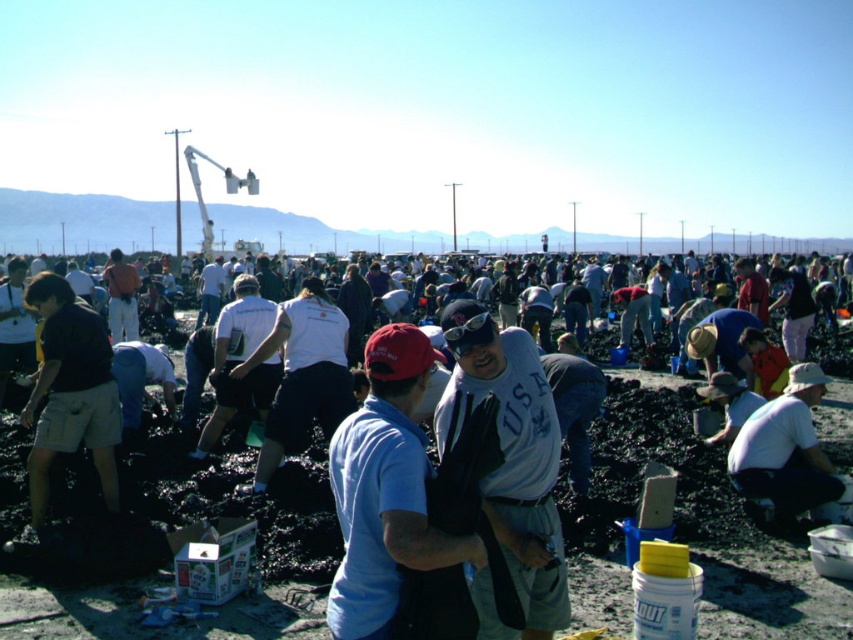
From the picture: Where is the dark khaki shorts at left located in the image?

The dark khaki shorts at left is located at point (70, 394) in the image.